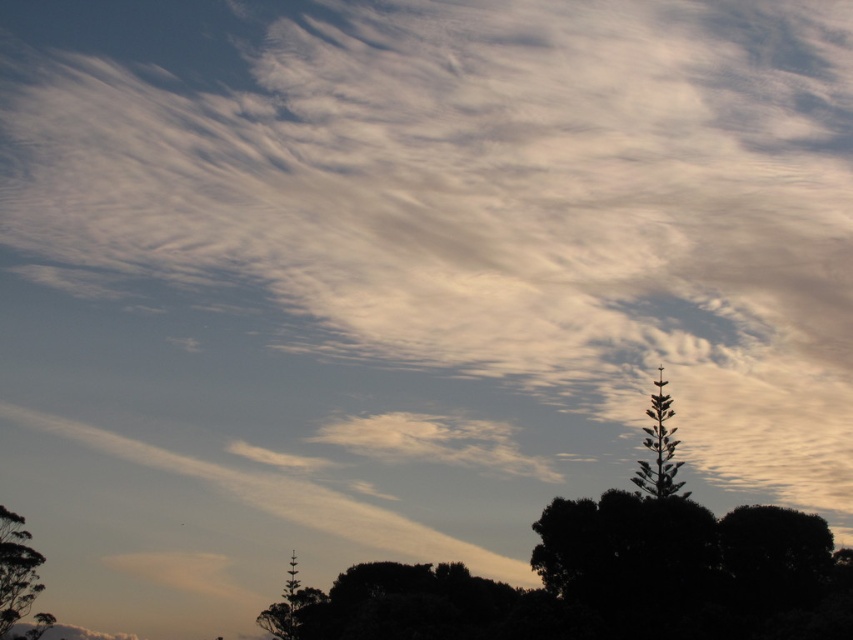
You are an ornithologist observing birds in the sky. You notice two green leafy trees in the scene. Which tree has a thicker trunk, the green leafy tree at lower left or the green leafy tree at upper right?

The green leafy tree at upper right has a thicker trunk than the green leafy tree at lower left.

You are an ornithologist observing birds in the sky. You notice two green leafy trees in the scene. Which tree is positioned higher in the sky between the green leafy tree at upper right and the green leafy tree at center?

The green leafy tree at upper right is positioned higher in the sky compared to the green leafy tree at center.

You are standing in a field and see two green leafy trees. One is the green leafy tree at lower left and the other is the green leafy tree at center. Which tree is closer to your left side?

The green leafy tree at lower left is positioned on the left side of green leafy tree at center, so the green leafy tree at lower left is closer to your left side.